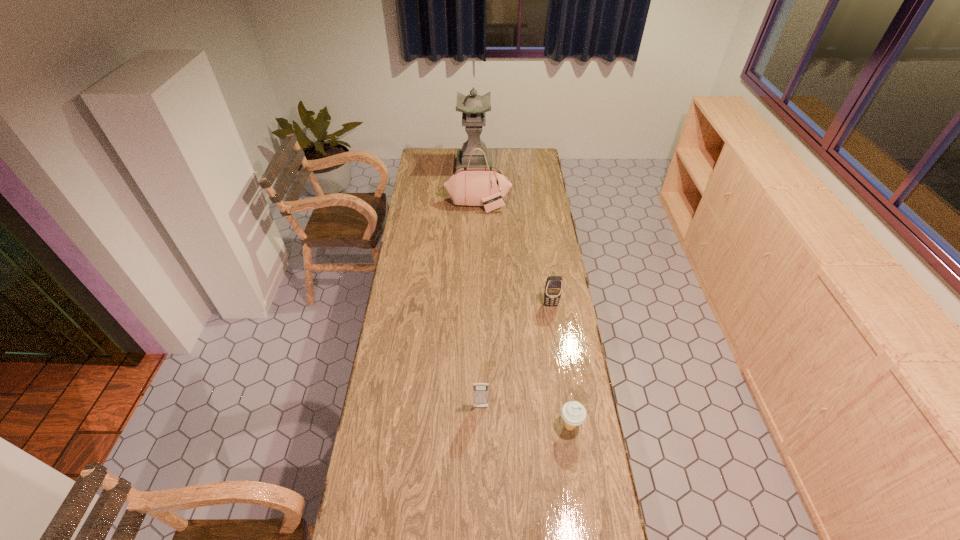
I want to click on vacant space located on the side of the handbag with the attached pouch, so click(x=478, y=232).

Identify the location of free space located 0.080m on the front-facing side of the left cellular telephone. (481, 433).

I want to click on vacant area located on the front face of the third farthest object, so click(x=556, y=338).

Identify the location of vacant space situated 0.400m on the back of the nearest object. This screenshot has width=960, height=540. (555, 325).

Where is `object that is positioned at the far edge`? This screenshot has height=540, width=960. object that is positioned at the far edge is located at coordinates (473, 107).

The width and height of the screenshot is (960, 540). I want to click on cellular telephone located at the right edge, so click(553, 288).

Where is `icecream that is at the right edge`? icecream that is at the right edge is located at coordinates (573, 413).

Locate an element on the screen. The height and width of the screenshot is (540, 960). vacant space at the far edge of the desktop is located at coordinates (502, 156).

Identify the location of vacant space at the left edge. (420, 285).

What are the coordinates of `free point at the right edge` in the screenshot? It's located at (533, 211).